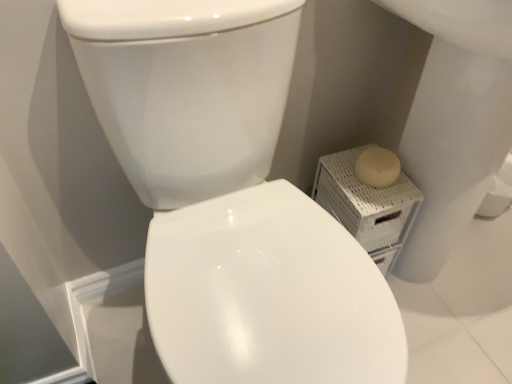
Find the location of a particular element. The height and width of the screenshot is (384, 512). white glossy toilet at center is located at coordinates (229, 197).

The width and height of the screenshot is (512, 384). What are the coordinates of `white glossy bidet at center` in the screenshot? It's located at tap(268, 294).

Identify the location of white glossy toilet at center. Image resolution: width=512 pixels, height=384 pixels. (229, 197).

Considering the points (367, 220) and (217, 238), which point is behind, point (367, 220) or point (217, 238)?

The point (367, 220) is farther from the camera.

From a real-world perspective, is beige wicker basket at right physically below white glossy toilet at center?

Yes.

From the image's perspective, is white glossy bidet at center on top of white glossy toilet at center?

Incorrect, from the image's perspective, white glossy bidet at center is lower than white glossy toilet at center.

Considering the positions of points (221, 363) and (187, 88), is point (221, 363) farther from camera compared to point (187, 88)?

That is False.

Which object is positioned more to the right, white glossy bidet at center or white glossy toilet at center?

From the viewer's perspective, white glossy bidet at center appears more on the right side.

From a real-world perspective, is white glossy bidet at center located beneath beige wicker basket at right?

Yes, from a real-world perspective, white glossy bidet at center is below beige wicker basket at right.

What's the angular difference between white glossy bidet at center and beige wicker basket at right's facing directions?

The angular difference between white glossy bidet at center and beige wicker basket at right is 88.6 degrees.

Is point (170, 246) farther from camera compared to point (340, 191)?

No, it is in front of (340, 191).

In the scene shown: Are white glossy bidet at center and beige wicker basket at right beside each other?

white glossy bidet at center and beige wicker basket at right are clearly separated.

Does white glossy toilet at center have a greater height compared to white glossy bidet at center?

Indeed, white glossy toilet at center has a greater height compared to white glossy bidet at center.

Does white glossy toilet at center have a lesser width compared to white glossy bidet at center?

Indeed, white glossy toilet at center has a lesser width compared to white glossy bidet at center.

Consider the image. Considering their positions, is white glossy toilet at center located in front of or behind white glossy bidet at center?

Clearly, white glossy toilet at center is in front of white glossy bidet at center.

Considering the positions of objects white glossy toilet at center and white glossy bidet at center in the image provided, who is more to the right, white glossy toilet at center or white glossy bidet at center?

white glossy bidet at center.

Find the location of a particular element. This screenshot has height=384, width=512. bidet below the beige wicker basket at right (from the image's perspective) is located at coordinates (268, 294).

Which of these two, beige wicker basket at right or white glossy bidet at center, stands shorter?

With less height is white glossy bidet at center.

Do you think beige wicker basket at right is within white glossy bidet at center, or outside of it?

beige wicker basket at right lies outside white glossy bidet at center.

Based on the photo, how different are the orientations of beige wicker basket at right and white glossy bidet at center in degrees?

There is a 88.6-degree angle between the facing directions of beige wicker basket at right and white glossy bidet at center.

Is the position of white glossy toilet at center more distant than that of beige wicker basket at right?

No, it is not.

From a real-world perspective, is white glossy toilet at center physically located above or below beige wicker basket at right?

white glossy toilet at center is above beige wicker basket at right.

From the image's perspective, between white glossy toilet at center and beige wicker basket at right, which one is located above?

beige wicker basket at right is shown above in the image.

Is white glossy toilet at center bigger than beige wicker basket at right?

Correct, white glossy toilet at center is larger in size than beige wicker basket at right.

This screenshot has width=512, height=384. Identify the location of porcelain on the right of the white glossy toilet at center. (367, 205).

This screenshot has height=384, width=512. What are the coordinates of `toilet above the white glossy bidet at center (from a real-world perspective)` in the screenshot? It's located at (229, 197).

When comparing their distances from beige wicker basket at right, does white glossy bidet at center or white glossy toilet at center seem further?

white glossy toilet at center is positioned further to the anchor beige wicker basket at right.

When comparing their distances from white glossy bidet at center, does beige wicker basket at right or white glossy toilet at center seem further?

The object further to white glossy bidet at center is beige wicker basket at right.

Looking at the image, which one is located closer to white glossy bidet at center, white glossy toilet at center or beige wicker basket at right?

white glossy toilet at center is positioned closer to the anchor white glossy bidet at center.

Which object lies nearer to the anchor point white glossy toilet at center, white glossy bidet at center or beige wicker basket at right?

Among the two, white glossy bidet at center is located nearer to white glossy toilet at center.

Estimate the real-world distances between objects in this image. Which object is further from beige wicker basket at right, white glossy toilet at center or white glossy bidet at center?

Among the two, white glossy toilet at center is located further to beige wicker basket at right.

From the image, which object appears to be nearer to white glossy toilet at center, beige wicker basket at right or white glossy bidet at center?

white glossy bidet at center.

You are a GUI agent. You are given a task and a screenshot of the screen. Output one action in this format:
    pyautogui.click(x=<x>, y=<y>)
    Task: Click on the bidet between white glossy toilet at center and beige wicker basket at right along the z-axis
    
    Given the screenshot: What is the action you would take?
    pyautogui.click(x=268, y=294)